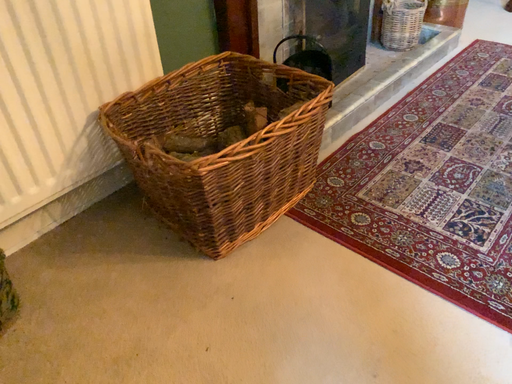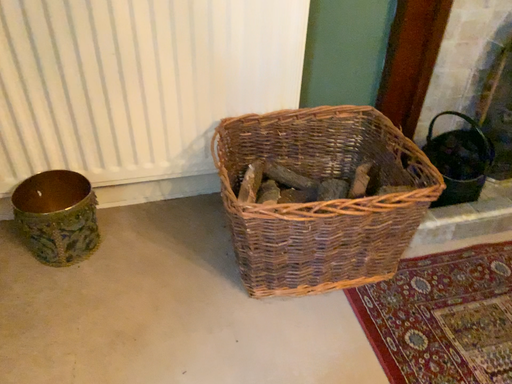
Question: Which way did the camera rotate in the video?

Choices:
 (A) rotated downward
 (B) rotated upward

Answer: (B)